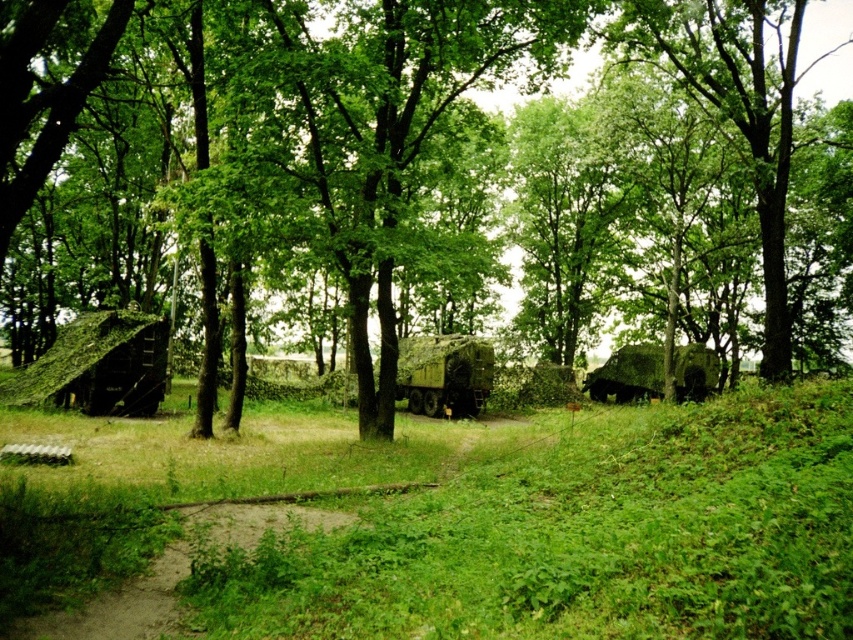
You are a soldier in the forest and need to decide where to place your equipment. The green leafy tree at center and the camouflage fabric tent at center are both in your path. Which object is bigger and would provide more shade?

The green leafy tree at center is larger than the camouflage fabric tent at center, so it would provide more shade.

You are a soldier in the forest and need to set up a temporary camp. You have to choose between placing your equipment on the green grassy at lower center or under the camouflage fabric tent at center. Which location would be more visible to aerial surveillance?

The green grassy at lower center is more visible to aerial surveillance because it is in front of the camouflage fabric tent at center, making it stand out against the background.